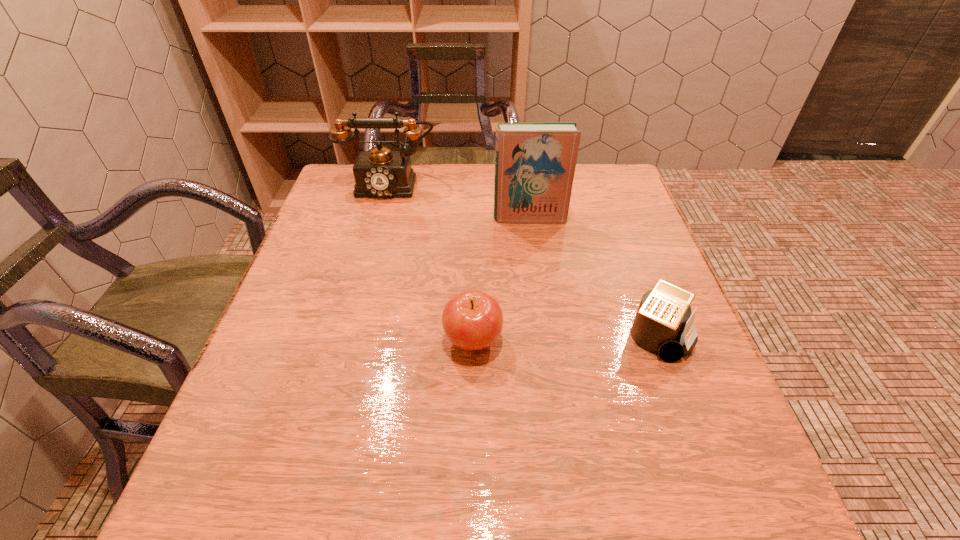
The height and width of the screenshot is (540, 960). I want to click on hardback book, so click(535, 163).

Image resolution: width=960 pixels, height=540 pixels. In order to click on the tallest object in this screenshot , I will do `click(535, 163)`.

Locate an element on the screen. Image resolution: width=960 pixels, height=540 pixels. the leftmost object is located at coordinates (379, 173).

Image resolution: width=960 pixels, height=540 pixels. In order to click on telephone in this screenshot , I will do `click(379, 173)`.

Where is `the third tallest object`? The width and height of the screenshot is (960, 540). the third tallest object is located at coordinates (472, 320).

At what (x,y) coordinates should I click in order to perform the action: click on the rightmost object. Please return your answer as a coordinate pair (x, y). Looking at the image, I should click on (663, 324).

This screenshot has width=960, height=540. Identify the location of the shortest object. (663, 324).

The width and height of the screenshot is (960, 540). Identify the location of free location located on the cover of the hardback book. pos(547,347).

Locate an element on the screen. vacant space located 0.210m on the front of the telephone at the rotary dial is located at coordinates (372, 252).

This screenshot has width=960, height=540. Find the location of `free space located 0.280m on the back of the third tallest object`. free space located 0.280m on the back of the third tallest object is located at coordinates (474, 231).